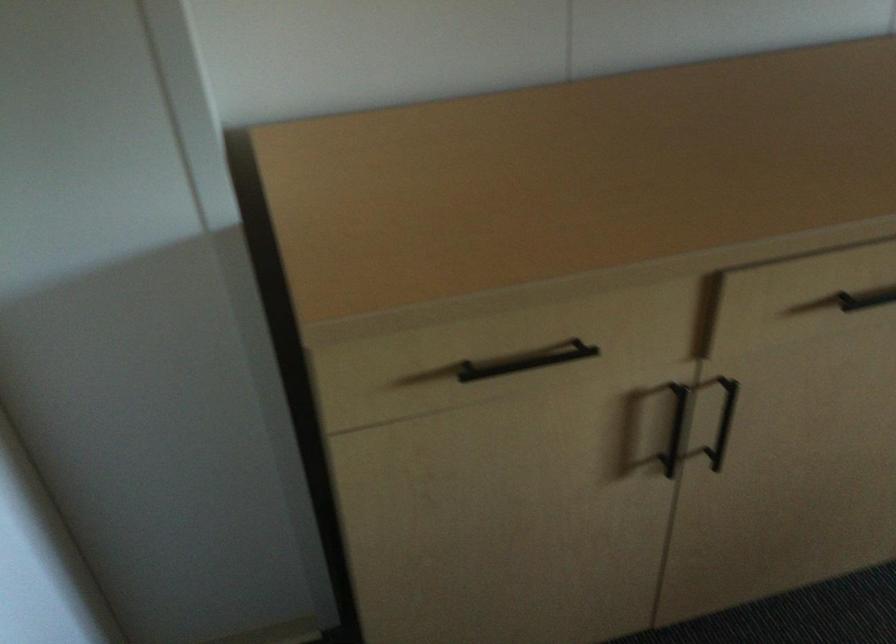
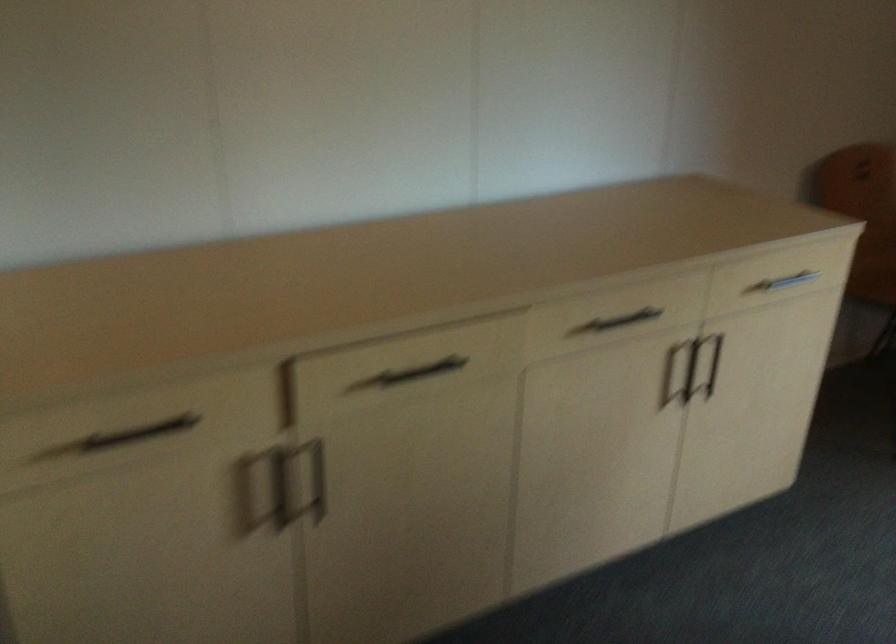
Which direction would the cameraman need to move to produce the second image?

The movement direction of the cameraman is right, backward.